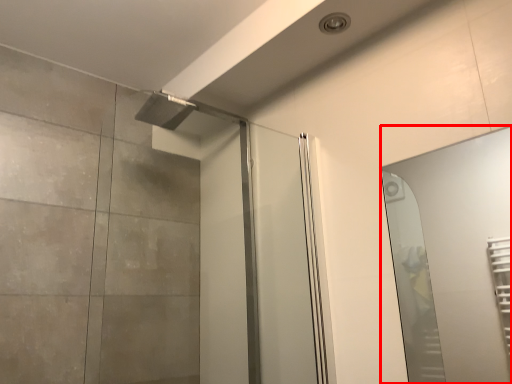
Question: From the image, what is the correct spatial relationship of mirror (annotated by the red box) in relation to screen door?

Choices:
 (A) right
 (B) left

Answer: (A)